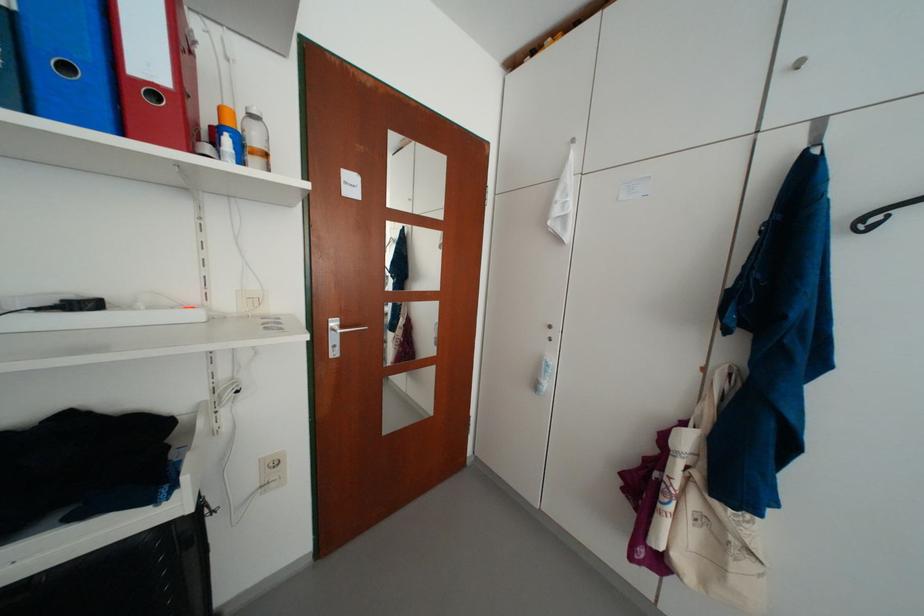
Where would you lift the blue ring binder? Please return your answer as a coordinate pair (x, y).

(69, 62)